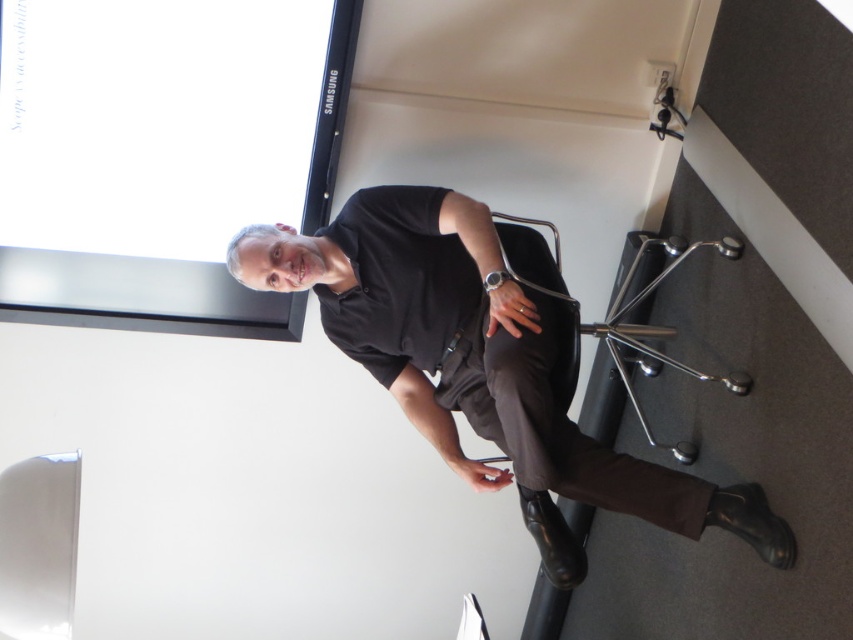
Question: Which object is the closest to the matte black screen at upper center?

Choices:
 (A) metallic silver swivel chair at lower right
 (B) black smooth shirt at center

Answer: (B)

Question: Which point is farther from the camera taking this photo?

Choices:
 (A) (19, 76)
 (B) (635, 358)

Answer: (B)

Question: Which of the following is the farthest from the observer?

Choices:
 (A) pos(366,342)
 (B) pos(339,88)

Answer: (B)

Question: Does matte black screen at upper center appear under metallic silver swivel chair at lower right?

Choices:
 (A) yes
 (B) no

Answer: (B)

Question: Does matte black screen at upper center have a larger size compared to metallic silver swivel chair at lower right?

Choices:
 (A) yes
 (B) no

Answer: (A)

Question: Is matte black screen at upper center to the left of metallic silver swivel chair at lower right from the viewer's perspective?

Choices:
 (A) yes
 (B) no

Answer: (A)